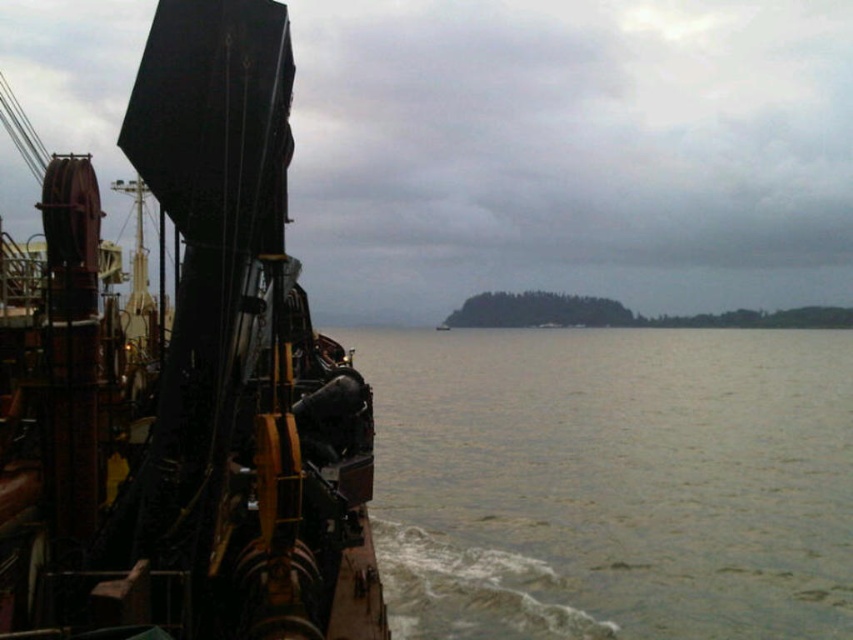
Question: Is metallic sheen ship at left wider than greenish water at lower left?

Choices:
 (A) no
 (B) yes

Answer: (A)

Question: Which point is closer to the camera?

Choices:
 (A) greenish water at lower left
 (B) metallic sheen ship at left

Answer: (B)

Question: Among these objects, which one is nearest to the camera?

Choices:
 (A) greenish water at lower left
 (B) metallic sheen ship at left

Answer: (B)

Question: Does metallic sheen ship at left have a larger size compared to greenish water at lower left?

Choices:
 (A) yes
 (B) no

Answer: (B)

Question: Can you confirm if metallic sheen ship at left is smaller than greenish water at lower left?

Choices:
 (A) yes
 (B) no

Answer: (A)